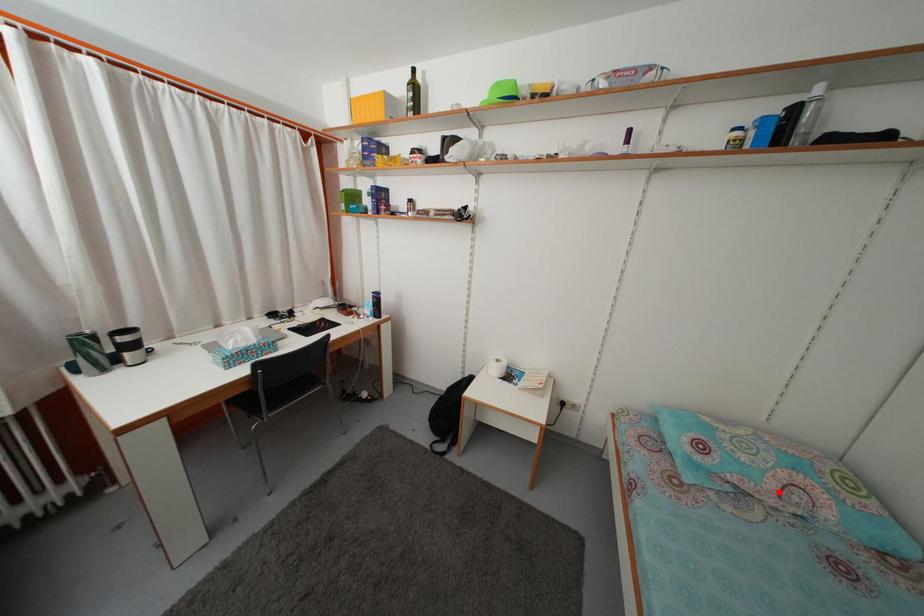
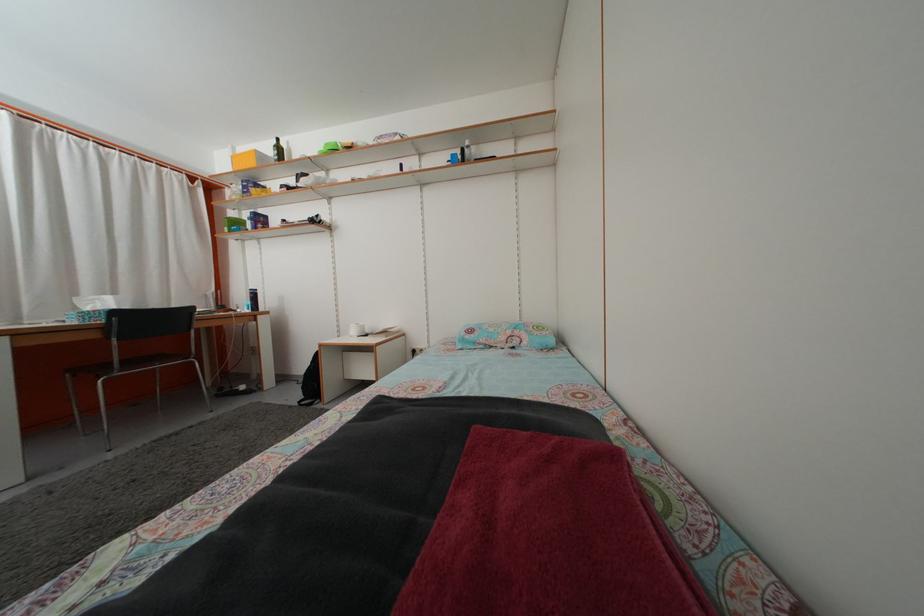
In the second image, find the point that corresponds to the highlighted location in the first image.

(508, 346)